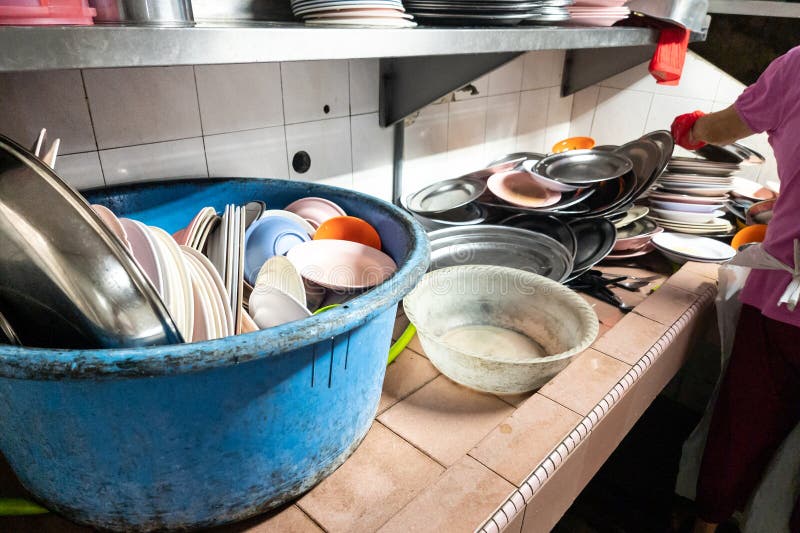
You are a GUI agent. You are given a task and a screenshot of the screen. Output one action in this format:
    pyautogui.click(x=<x>, y=<y>)
    Task: Click on the blue basin
    This screenshot has width=800, height=533.
    Given the screenshot: What is the action you would take?
    pyautogui.click(x=282, y=405)